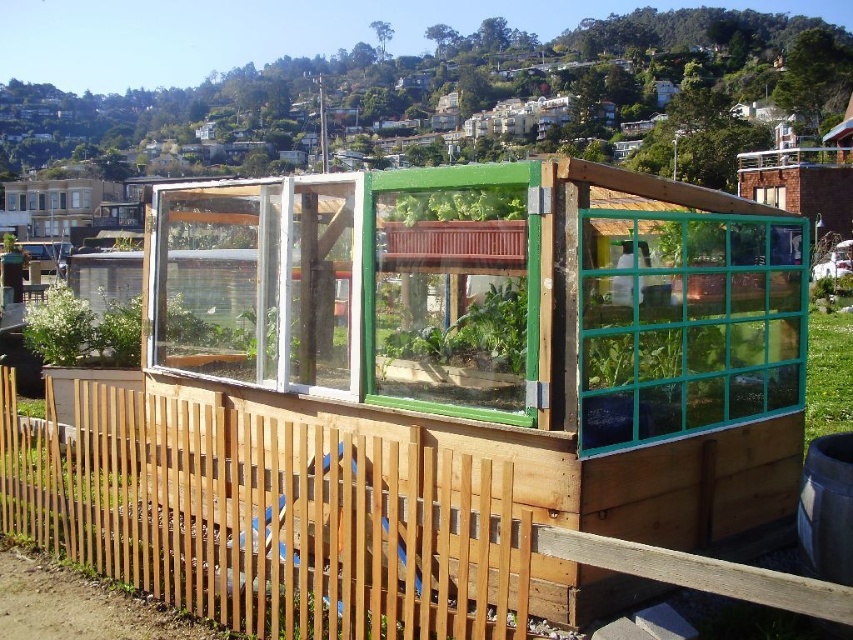
You are standing in front of the greenhouse and want to take a photo. There are two points marked on the greenhouse structure. Which point, point (633, 368) or point (41, 326), is closer to your camera when taking the photo?

Point (633, 368) is closer to the camera than point (41, 326).

You are a gardener who needs to check the sunlight exposure of the greenhouse. You notice the teal glass window at center right and the green plastic window at center. Which window is shorter in height?

The teal glass window at center right is not as tall as the green plastic window at center, so the teal glass window at center right is shorter in height.